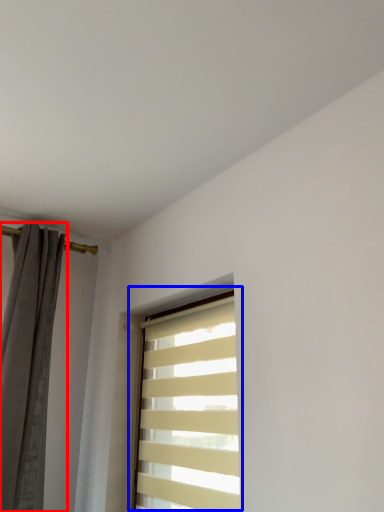
Question: Which of the following is the closest to the observer, curtain (highlighted by a red box) or window (highlighted by a blue box)?

Choices:
 (A) curtain
 (B) window

Answer: (B)